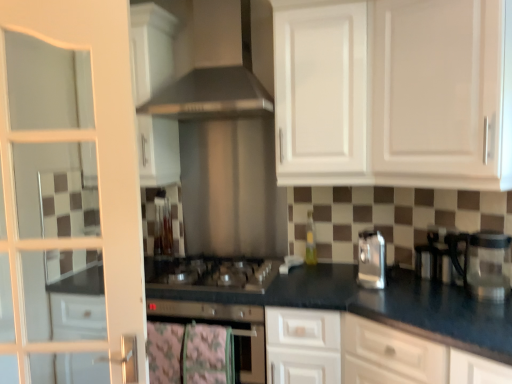
Identify the location of vacant space that is to the left of satin silver toaster at right. The height and width of the screenshot is (384, 512). (328, 291).